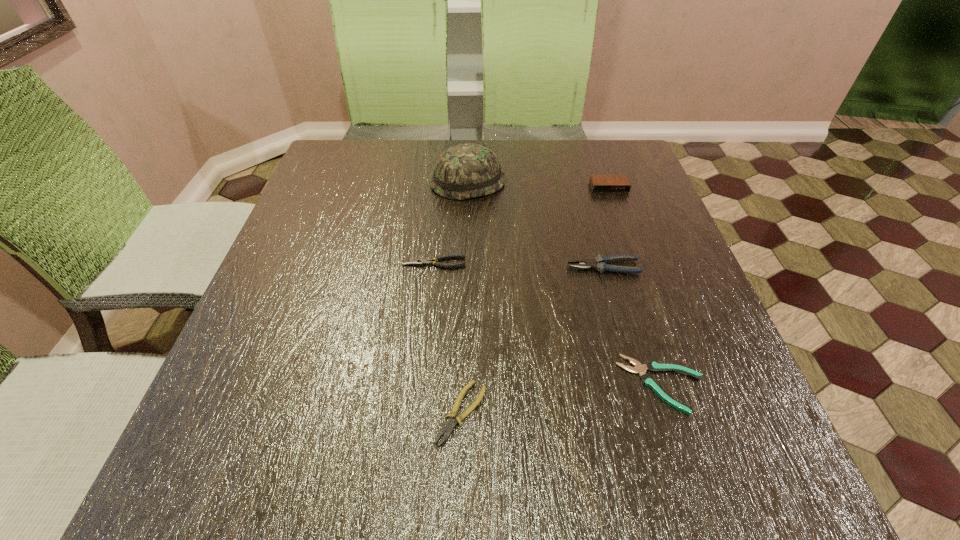
Identify the location of headwear. The height and width of the screenshot is (540, 960). (464, 171).

I want to click on the second tallest object, so click(x=599, y=183).

The width and height of the screenshot is (960, 540). What are the coordinates of `the tallest pliers` in the screenshot? It's located at (599, 263).

In order to click on the third shortest object in this screenshot , I will do `click(418, 262)`.

The height and width of the screenshot is (540, 960). What are the coordinates of `free point located on the front of the headwear` in the screenshot? It's located at (466, 248).

Identify the location of free spot located 0.380m on the front face of the fifth shortest object. Image resolution: width=960 pixels, height=540 pixels. (650, 304).

Identify the location of free space located at the gripping part of the third tallest object. The height and width of the screenshot is (540, 960). (434, 267).

Image resolution: width=960 pixels, height=540 pixels. Identify the location of vacant space situated 0.360m at the gripping part of the third tallest object. (402, 267).

Image resolution: width=960 pixels, height=540 pixels. In order to click on blank space located at the gripping part of the third tallest object in this screenshot , I will do `click(494, 267)`.

What are the coordinates of `free space located on the back of the fourth tallest object` in the screenshot? It's located at (443, 180).